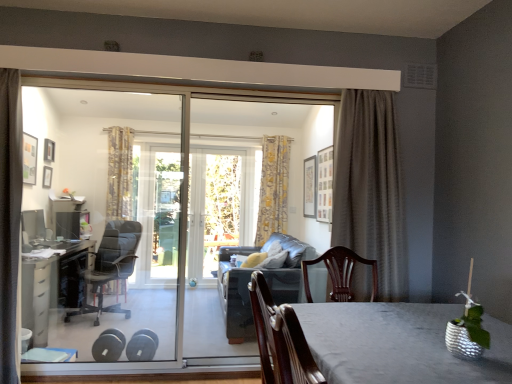
Question: From the image's perspective, is black plastic desk at left, the second table in the front-to-back sequence, on black leather office chair at left?

Choices:
 (A) yes
 (B) no

Answer: (B)

Question: Is black plastic desk at left, the first table when ordered from back to front, next to black leather office chair at left?

Choices:
 (A) yes
 (B) no

Answer: (B)

Question: Considering the relative positions of black plastic desk at left, the second table in the front-to-back sequence, and black leather office chair at left in the image provided, is black plastic desk at left, the second table in the front-to-back sequence, to the left of black leather office chair at left from the viewer's perspective?

Choices:
 (A) no
 (B) yes

Answer: (B)

Question: Is black plastic desk at left, the first table when ordered from back to front, thinner than black leather office chair at left?

Choices:
 (A) no
 (B) yes

Answer: (A)

Question: From a real-world perspective, is silvery metallic table at center, which ranks as the first table in front-to-back order, positioned above or below transparent glass door at center?

Choices:
 (A) below
 (B) above

Answer: (A)

Question: In terms of width, does silvery metallic table at center, which is the 2th table in back-to-front order, look wider or thinner when compared to transparent glass door at center?

Choices:
 (A) wide
 (B) thin

Answer: (A)

Question: Which is correct: silvery metallic table at center, which is the 1th table in right-to-left order, is inside transparent glass door at center, or outside of it?

Choices:
 (A) inside
 (B) outside

Answer: (B)

Question: Is silvery metallic table at center, which is the 1th table in right-to-left order, taller or shorter than transparent glass door at center?

Choices:
 (A) short
 (B) tall

Answer: (A)

Question: Considering their positions, is black plastic desk at left, which appears as the second table when viewed from the right, located in front of or behind silvery metallic table at center, which is the 2th table in back-to-front order?

Choices:
 (A) behind
 (B) front

Answer: (A)

Question: Which is correct: black plastic desk at left, the second table in the front-to-back sequence, is inside silvery metallic table at center, which is the 2th table in back-to-front order, or outside of it?

Choices:
 (A) outside
 (B) inside

Answer: (A)

Question: From a real-world perspective, is black plastic desk at left, the first table when ordered from back to front, positioned above or below silvery metallic table at center, which ranks as the first table in front-to-back order?

Choices:
 (A) above
 (B) below

Answer: (B)

Question: Is black plastic desk at left, which appears as the second table when viewed from the right, bigger or smaller than silvery metallic table at center, which ranks as the first table in front-to-back order?

Choices:
 (A) small
 (B) big

Answer: (B)

Question: Is yellow floral fabric curtain at center, which is counted as the 2th curtain, starting from the left, bigger or smaller than dark grey textured curtain at right, which appears as the third curtain when viewed from the back?

Choices:
 (A) big
 (B) small

Answer: (B)

Question: Choose the correct answer: Is yellow floral fabric curtain at center, which is counted as the 2th curtain, starting from the left, inside dark grey textured curtain at right, marked as the 1th curtain in a front-to-back arrangement, or outside it?

Choices:
 (A) outside
 (B) inside

Answer: (A)